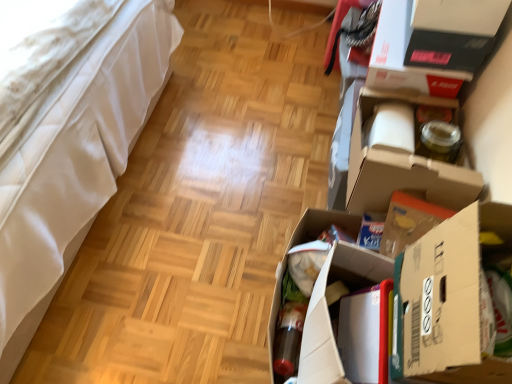
Question: Visually, is white leather bed at left positioned to the left or to the right of cardboard box at center, the third cardboard box positioned from the front?

Choices:
 (A) left
 (B) right

Answer: (A)

Question: Looking at the image, does white leather bed at left seem bigger or smaller compared to cardboard box at center, which is the 1th cardboard box from back to front?

Choices:
 (A) big
 (B) small

Answer: (A)

Question: Estimate the real-world distances between objects in this image. Which object is closer to the cardboard box at center, the third cardboard box positioned from the front?

Choices:
 (A) matte black storage box at upper right
 (B) cardboard box at lower right, the second cardboard box in the back-to-front sequence
 (C) white cardboard box at right, the third cardboard box from the back
 (D) white leather bed at left

Answer: (B)

Question: Estimate the real-world distances between objects in this image. Which object is closer to the white cardboard box at right, the third cardboard box from the back?

Choices:
 (A) cardboard box at lower right, the second cardboard box in the back-to-front sequence
 (B) white leather bed at left
 (C) cardboard box at center, the third cardboard box positioned from the front
 (D) matte black storage box at upper right

Answer: (C)